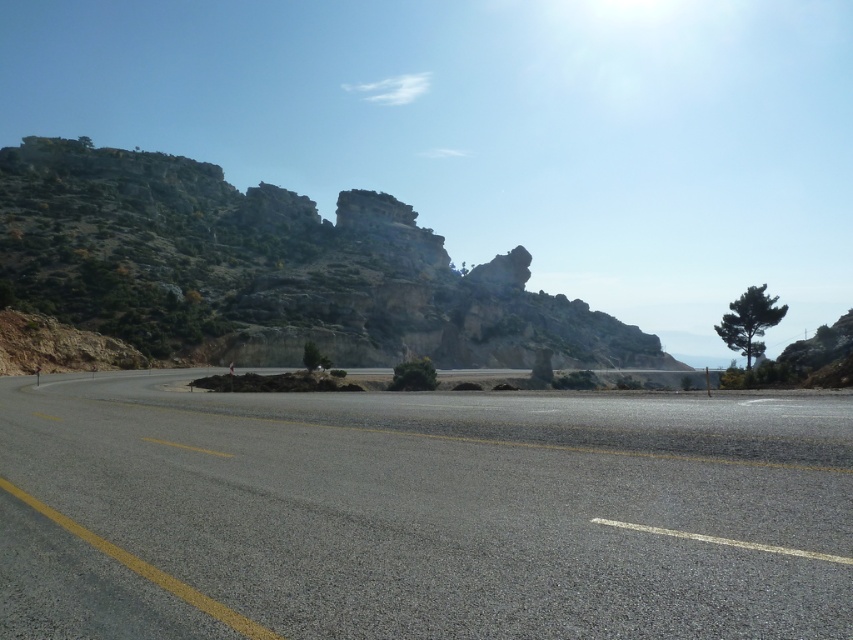
Can you confirm if asphalt road at center is shorter than brown rocky mountain at upper left?

Yes.

You are a GUI agent. You are given a task and a screenshot of the screen. Output one action in this format:
    pyautogui.click(x=<x>, y=<y>)
    Task: Click on the asphalt road at center
    Image resolution: width=853 pixels, height=640 pixels.
    Given the screenshot: What is the action you would take?
    pyautogui.click(x=422, y=513)

You are a GUI agent. You are given a task and a screenshot of the screen. Output one action in this format:
    pyautogui.click(x=<x>, y=<y>)
    Task: Click on the asphalt road at center
    This screenshot has width=853, height=640.
    Given the screenshot: What is the action you would take?
    pyautogui.click(x=422, y=513)